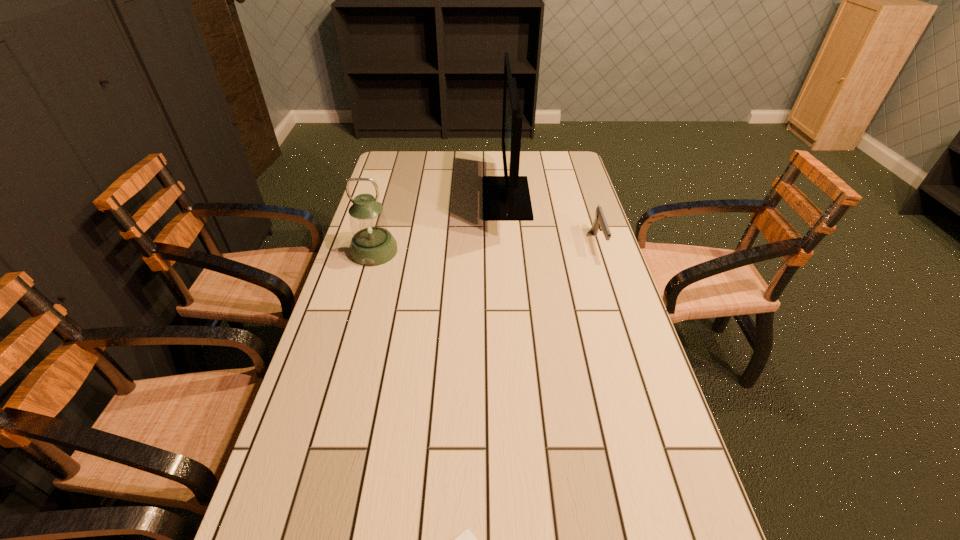
Locate an element on the screen. the tallest object is located at coordinates pos(505,198).

The image size is (960, 540). Find the location of `the third shortest object`. the third shortest object is located at coordinates (372, 244).

The width and height of the screenshot is (960, 540). I want to click on the leftmost object, so click(x=372, y=244).

Where is `the third tallest object`? The height and width of the screenshot is (540, 960). the third tallest object is located at coordinates (600, 223).

You are a GUI agent. You are given a task and a screenshot of the screen. Output one action in this format:
    pyautogui.click(x=<x>, y=<y>)
    Task: Click on the pistol
    
    Given the screenshot: What is the action you would take?
    pyautogui.click(x=600, y=223)

Where is `blank area located on the screen side of the tallest object`? The height and width of the screenshot is (540, 960). blank area located on the screen side of the tallest object is located at coordinates (469, 198).

What are the coordinates of `vacant space located 0.280m on the screen side of the tallest object` in the screenshot? It's located at (408, 198).

Where is `vacant area located 0.210m on the screen side of the tallest object`? Image resolution: width=960 pixels, height=540 pixels. vacant area located 0.210m on the screen side of the tallest object is located at coordinates (426, 198).

Identify the location of free point located 0.340m on the right of the lantern. The width and height of the screenshot is (960, 540). (504, 252).

At what (x,y) coordinates should I click in order to perform the action: click on vacant space positioned 0.110m at the barrel of the pistol. Please return your answer as a coordinate pair (x, y). Looking at the image, I should click on (611, 285).